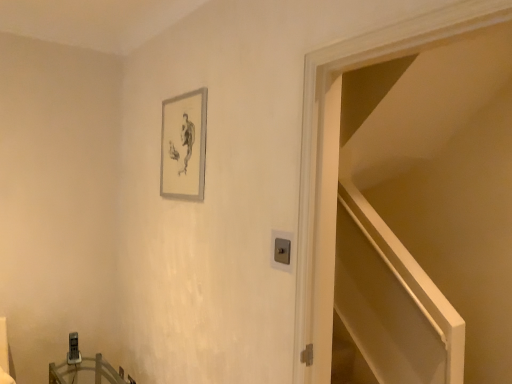
Question: Is silver metallic picture frame at upper center in front of or behind wooden table at lower left in the image?

Choices:
 (A) front
 (B) behind

Answer: (A)

Question: Considering the positions of silver metallic picture frame at upper center and wooden table at lower left in the image, is silver metallic picture frame at upper center taller or shorter than wooden table at lower left?

Choices:
 (A) short
 (B) tall

Answer: (B)

Question: Based on their relative distances, which object is farther from the wooden table at lower left?

Choices:
 (A) white glossy door at upper right
 (B) silver metallic picture frame at upper center

Answer: (A)

Question: Which of these objects is positioned farthest from the wooden table at lower left?

Choices:
 (A) white glossy door at upper right
 (B) silver metallic picture frame at upper center

Answer: (A)